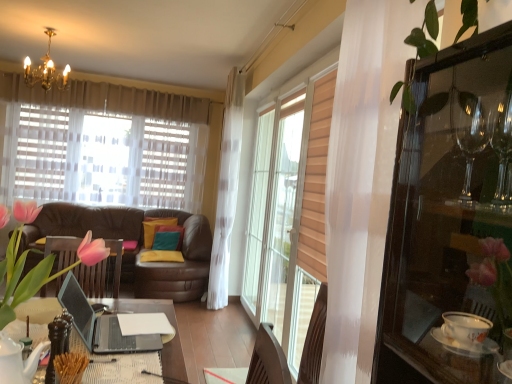
Question: Considering the relative positions of pink silk tulips at center and teal fabric pillow at center, which ranks as the third pillow in front-to-back order, in the image provided, is pink silk tulips at center to the right of teal fabric pillow at center, which ranks as the third pillow in front-to-back order, from the viewer's perspective?

Choices:
 (A) yes
 (B) no

Answer: (A)

Question: Is pink silk tulips at center bigger than teal fabric pillow at center, marked as the 1th pillow in a back-to-front arrangement?

Choices:
 (A) no
 (B) yes

Answer: (B)

Question: Is pink silk tulips at center thinner than teal fabric pillow at center, which ranks as the third pillow in front-to-back order?

Choices:
 (A) no
 (B) yes

Answer: (A)

Question: Can you confirm if pink silk tulips at center is taller than teal fabric pillow at center, marked as the 1th pillow in a back-to-front arrangement?

Choices:
 (A) yes
 (B) no

Answer: (A)

Question: Can you see pink silk tulips at center touching teal fabric pillow at center, marked as the 1th pillow in a back-to-front arrangement?

Choices:
 (A) yes
 (B) no

Answer: (B)

Question: From the image's perspective, is transparent glass cabinet at right above or below teal fabric pillow at center, which ranks as the second pillow in back-to-front order?

Choices:
 (A) above
 (B) below

Answer: (A)

Question: Which is correct: transparent glass cabinet at right is inside teal fabric pillow at center, placed as the 2th pillow when sorted from front to back, or outside of it?

Choices:
 (A) outside
 (B) inside

Answer: (A)

Question: In the image, is transparent glass cabinet at right positioned in front of or behind teal fabric pillow at center, which ranks as the second pillow in back-to-front order?

Choices:
 (A) behind
 (B) front

Answer: (B)

Question: In the image, is transparent glass cabinet at right on the left side or the right side of teal fabric pillow at center, which ranks as the second pillow in back-to-front order?

Choices:
 (A) left
 (B) right

Answer: (B)

Question: In terms of size, does pink silk tulips at center appear bigger or smaller than transparent glass cabinet at right?

Choices:
 (A) big
 (B) small

Answer: (B)

Question: From the image's perspective, is pink silk tulips at center located above or below transparent glass cabinet at right?

Choices:
 (A) below
 (B) above

Answer: (A)

Question: Is pink silk tulips at center spatially inside transparent glass cabinet at right, or outside of it?

Choices:
 (A) inside
 (B) outside

Answer: (B)

Question: Relative to transparent glass cabinet at right, is pink silk tulips at center in front or behind?

Choices:
 (A) front
 (B) behind

Answer: (B)

Question: From a real-world perspective, relative to pink silk tulips at center, is yellow fabric pillow at center, the third pillow from the back, vertically above or below?

Choices:
 (A) below
 (B) above

Answer: (A)

Question: Choose the correct answer: Is yellow fabric pillow at center, the third pillow from the back, inside pink silk tulips at center or outside it?

Choices:
 (A) outside
 (B) inside

Answer: (A)